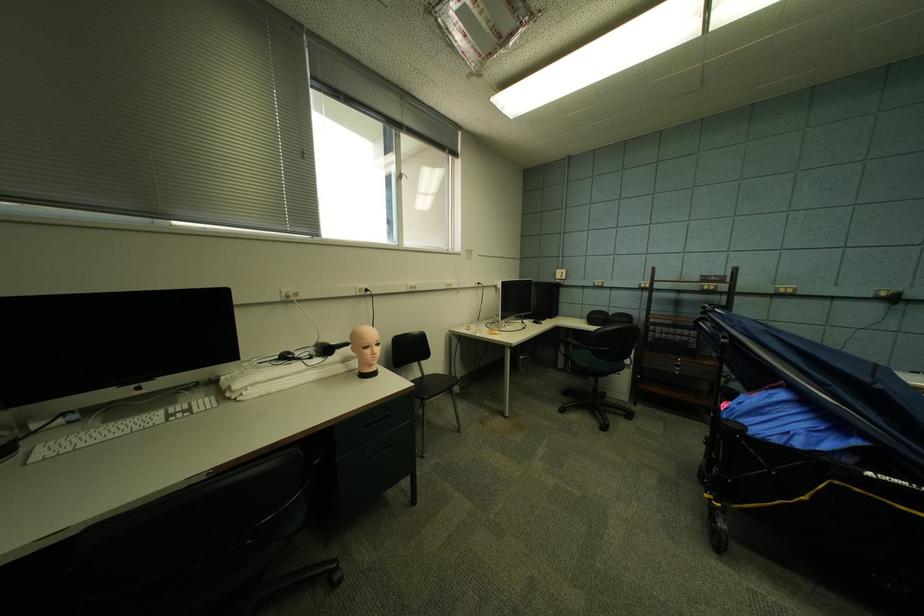
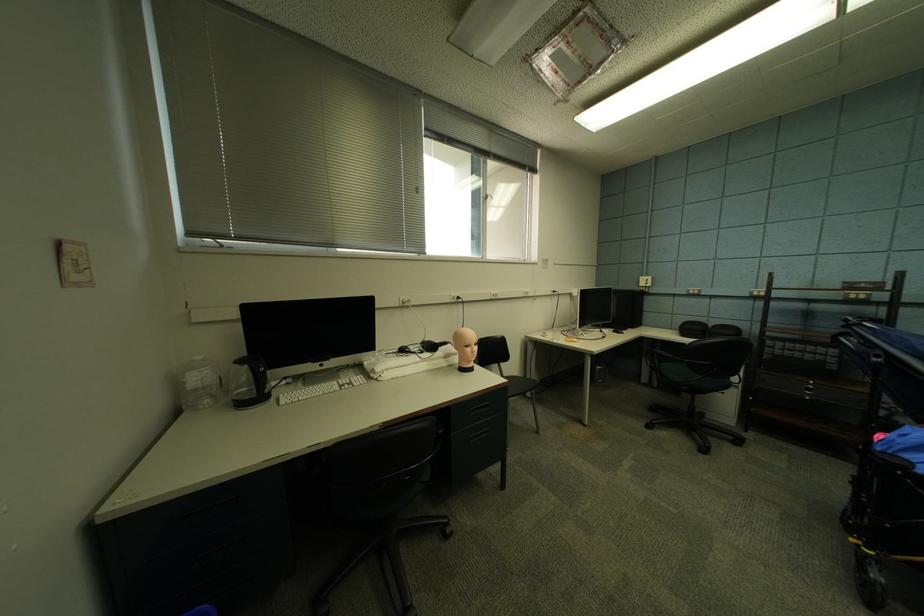
Where in the second image is the point corresponding to [422,387] from the first image?

(517, 382)